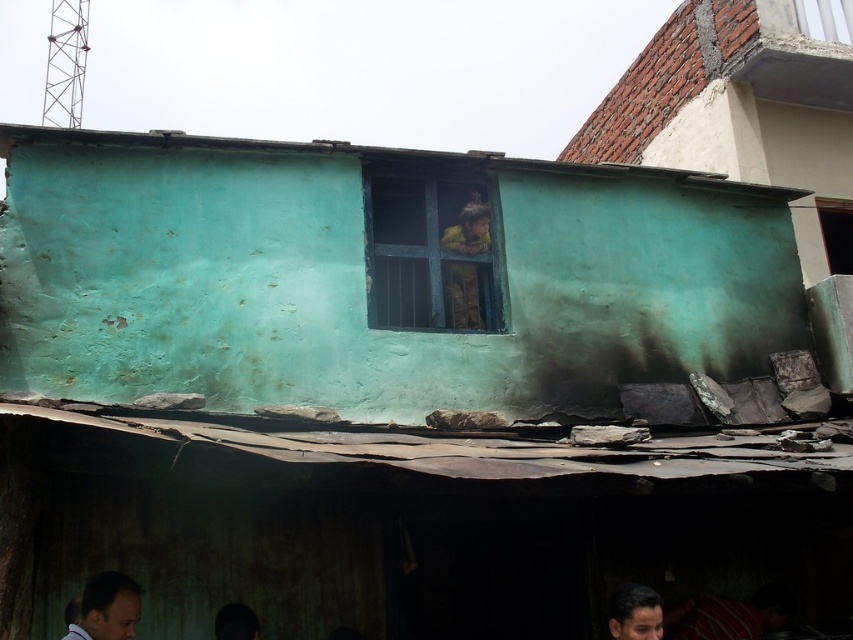
Consider the image. Does dark brown hair at lower left have a greater width compared to smooth brown hair at lower right?

Incorrect, dark brown hair at lower left's width does not surpass smooth brown hair at lower right's.

Is dark brown hair at lower left thinner than smooth brown hair at lower right?

Correct, dark brown hair at lower left's width is less than smooth brown hair at lower right's.

Who is more forward, (136, 582) or (619, 604)?

Point (619, 604) is more forward.

The width and height of the screenshot is (853, 640). What are the coordinates of `dark brown hair at lower left` in the screenshot? It's located at (107, 608).

The image size is (853, 640). What do you see at coordinates (740, 113) in the screenshot?
I see `teal painted wall at center` at bounding box center [740, 113].

Where is `teal painted wall at center`? teal painted wall at center is located at coordinates (740, 113).

Is teal painted wall at center smaller than smooth brown hair at lower right?

Actually, teal painted wall at center might be larger than smooth brown hair at lower right.

Is point (838, 49) behind point (616, 627)?

Yes.

Measure the distance between teal painted wall at center and camera.

teal painted wall at center is 7.48 meters from camera.

Find the location of a particular element. The image size is (853, 640). teal painted wall at center is located at coordinates (740, 113).